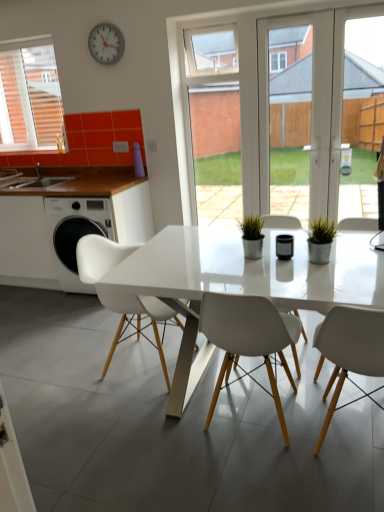
Question: From a real-world perspective, is white matte chair at left, which is the third chair in right-to-left order, positioned above or below transparent glass door at center?

Choices:
 (A) above
 (B) below

Answer: (B)

Question: Visually, is white matte chair at left, positioned as the 1th chair in left-to-right order, positioned to the left or to the right of transparent glass door at center?

Choices:
 (A) left
 (B) right

Answer: (A)

Question: Estimate the real-world distances between objects in this image. Which object is farther from the transparent glass door at center?

Choices:
 (A) white glossy table at center
 (B) white matte chair at center, the third chair in the left-to-right sequence
 (C) green matte plant at right
 (D) white matte chair at left, which is the third chair in right-to-left order
 (E) metallic gray clock at upper center

Answer: (B)

Question: Which object is positioned closest to the white glossy sink at left?

Choices:
 (A) transparent glass door at center
 (B) white matte chair at center, which is counted as the first chair, starting from the right
 (C) white glossy table at center
 (D) white matte chair at left, which is the third chair in right-to-left order
 (E) white matte chair at center, the second chair when ordered from left to right

Answer: (D)